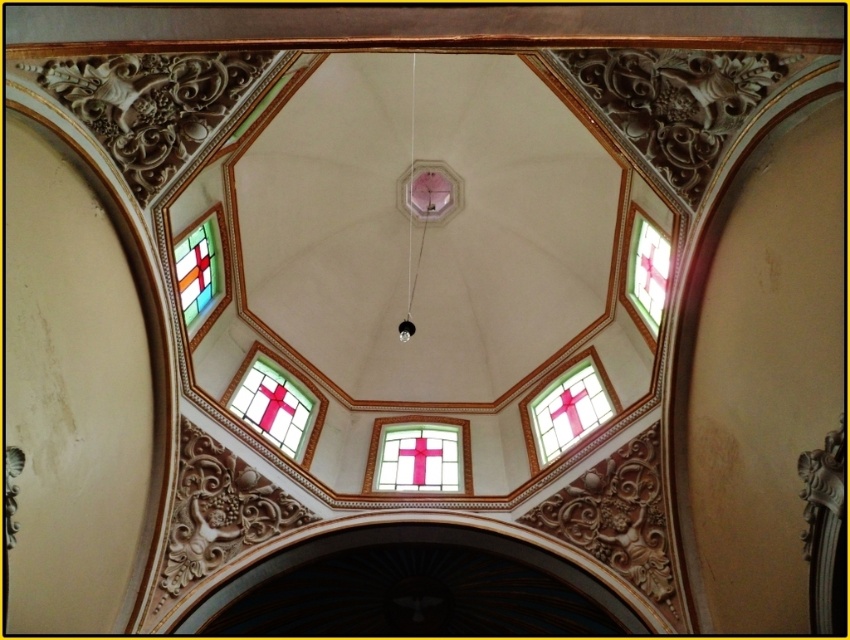
Question: Which point appears farthest from the camera in this image?

Choices:
 (A) (383, 486)
 (B) (315, 416)
 (C) (663, 269)
 (D) (197, 285)

Answer: (B)

Question: Which point is closer to the camera?

Choices:
 (A) stained glass window at upper left
 (B) pink stained glass cross at center
 (C) clear glass cross at lower left

Answer: (A)

Question: Which point is farther to the camera?

Choices:
 (A) translucent glass cross at upper right
 (B) clear glass cross at lower left
 (C) pink stained glass cross at center

Answer: (C)

Question: Is pink stained glass cross at center wider than clear glass cross at lower left?

Choices:
 (A) yes
 (B) no

Answer: (A)

Question: Can you confirm if pink stained glass cross at upper center is wider than clear glass cross at lower left?

Choices:
 (A) no
 (B) yes

Answer: (A)

Question: Can you confirm if pink stained glass cross at center is wider than pink stained glass cross at upper center?

Choices:
 (A) yes
 (B) no

Answer: (A)